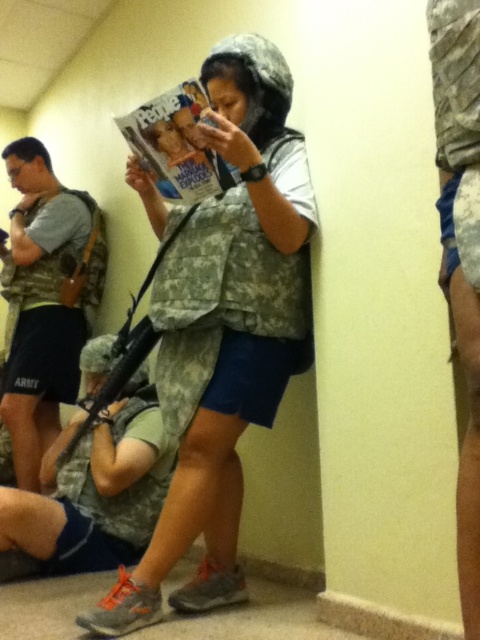
Question: Is camouflage vest at center below camouflage fabric rifle at center?

Choices:
 (A) yes
 (B) no

Answer: (B)

Question: Which point is farther from the camera taking this photo?

Choices:
 (A) (199, 225)
 (B) (176, 92)
 (C) (132, 497)

Answer: (C)

Question: Can you confirm if camouflage fabric backpack at left is positioned above camouflage fabric rifle at center?

Choices:
 (A) no
 (B) yes

Answer: (B)

Question: Is camouflage fabric backpack at left to the right of matte paper magazine at center from the viewer's perspective?

Choices:
 (A) no
 (B) yes

Answer: (A)

Question: Which object is farther from the camera taking this photo?

Choices:
 (A) camouflage fabric rifle at center
 (B) camouflage vest at center
 (C) matte paper magazine at center

Answer: (A)

Question: Which object appears farthest from the camera in this image?

Choices:
 (A) matte paper magazine at center
 (B) camouflage fabric rifle at center

Answer: (B)